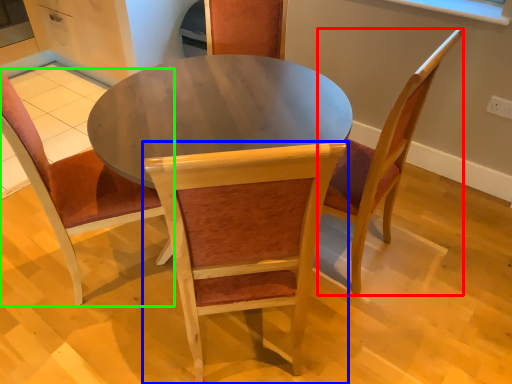
Question: Which is nearer to the chair (highlighted by a red box)? chair (highlighted by a blue box) or chair (highlighted by a green box).

Choices:
 (A) chair
 (B) chair

Answer: (A)